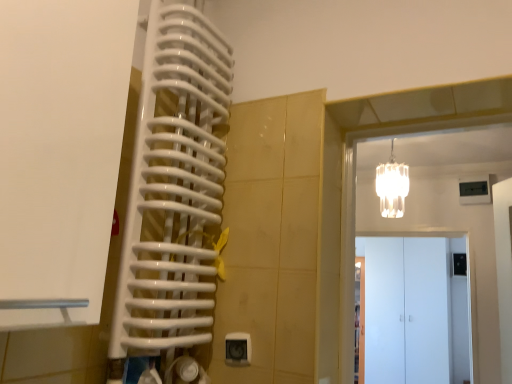
Locate an element on the screen. The image size is (512, 384). white matte cabinet at center, the 2th door viewed from the back is located at coordinates (418, 309).

Measure the distance between point (x=443, y=281) and camera.

Point (x=443, y=281) is 4.21 meters away from camera.

This screenshot has height=384, width=512. What are the coordinates of `white glossy door at right, the third door from the front` in the screenshot? It's located at (360, 319).

The image size is (512, 384). What do you see at coordinates (360, 319) in the screenshot?
I see `white glossy door at right, the 3th door viewed from the top` at bounding box center [360, 319].

Locate an element on the screen. Image resolution: width=512 pixels, height=384 pixels. white matte door at left, placed as the 1th door when sorted from left to right is located at coordinates (60, 153).

From a real-world perspective, who is located lower, white matte door at left, arranged as the 3th door when ordered from the bottom, or white glossy door at right, the first door from the back?

white glossy door at right, the first door from the back.

From the image's perspective, which door is the 2nd one above the white glossy door at right, which is counted as the first door, starting from the bottom? Please provide its 2D coordinates.

[(60, 153)]

How far apart are white matte door at left, placed as the 1th door when sorted from left to right, and white glossy door at right, the first door from the back?

3.26 meters.

Which object is positioned more to the right, white matte door at left, arranged as the 3th door when ordered from the bottom, or white glossy door at right, the third door from the front?

Positioned to the right is white glossy door at right, the third door from the front.

Measure the distance from white matte cabinet at center, acting as the second door starting from the right, to white glass chandelier at upper right.

The distance of white matte cabinet at center, acting as the second door starting from the right, from white glass chandelier at upper right is 6.02 feet.

Does white matte cabinet at center, which ranks as the 2th door in top-to-bottom order, have a greater height compared to white glass chandelier at upper right?

Indeed, white matte cabinet at center, which ranks as the 2th door in top-to-bottom order, has a greater height compared to white glass chandelier at upper right.

From a real-world perspective, which object stands above the other?

From a 3D spatial view, white glass chandelier at upper right is above.

Locate an element on the screen. light fixture above the white matte cabinet at center, the 2th door when ordered from left to right (from the image's perspective) is located at coordinates (392, 186).

From the image's perspective, starting from the white matte door at left, the 3th door viewed from the right, which door is the 1st one below? Please provide its 2D coordinates.

[(418, 309)]

Could you tell me if white matte cabinet at center, acting as the second door starting from the right, is facing white matte door at left, which appears as the third door when viewed from the back?

Yes, white matte cabinet at center, acting as the second door starting from the right, is oriented towards white matte door at left, which appears as the third door when viewed from the back.

Based on their sizes in the image, would you say white matte cabinet at center, the 2th door viewed from the front, is bigger or smaller than white matte door at left, the 3th door viewed from the right?

Clearly, white matte cabinet at center, the 2th door viewed from the front, is smaller in size than white matte door at left, the 3th door viewed from the right.

From the image's perspective, relative to white matte door at left, placed as the 1th door when sorted from left to right, is white matte cabinet at center, the 2th door viewed from the back, above or below?

Based on their image positions, white matte cabinet at center, the 2th door viewed from the back, is located beneath white matte door at left, placed as the 1th door when sorted from left to right.

Which point is more forward, (388,211) or (409,273)?

The point (388,211) is more forward.

From the image's perspective, which object appears higher, white glass chandelier at upper right or white matte cabinet at center, marked as the second door in a bottom-to-top arrangement?

white glass chandelier at upper right, from the image's perspective.

In the scene shown: Choose the correct answer: Is white glass chandelier at upper right inside white matte cabinet at center, marked as the second door in a bottom-to-top arrangement, or outside it?

white glass chandelier at upper right cannot be found inside white matte cabinet at center, marked as the second door in a bottom-to-top arrangement.

From a real-world perspective, is white glass chandelier at upper right physically located above or below white matte cabinet at center, marked as the second door in a bottom-to-top arrangement?

From a real-world perspective, white glass chandelier at upper right is physically above white matte cabinet at center, marked as the second door in a bottom-to-top arrangement.

Is white glass chandelier at upper right oriented towards white matte door at left, placed as the 1th door when sorted from left to right?

Yes, white glass chandelier at upper right is oriented towards white matte door at left, placed as the 1th door when sorted from left to right.

Based on the photo, does white glass chandelier at upper right have a lesser width compared to white matte door at left, marked as the 1th door in a front-to-back arrangement?

Yes, white glass chandelier at upper right is thinner than white matte door at left, marked as the 1th door in a front-to-back arrangement.

From a real-world perspective, between white glass chandelier at upper right and white matte door at left, the 3th door viewed from the right, who is vertically higher?

From a 3D spatial view, white glass chandelier at upper right is above.

Is white glass chandelier at upper right located outside white matte door at left, arranged as the 3th door when ordered from the bottom?

That's correct, white glass chandelier at upper right is outside of white matte door at left, arranged as the 3th door when ordered from the bottom.

Can you tell me how much white glossy door at right, the first door from the back, and white matte door at left, placed as the 1th door when sorted from left to right, differ in facing direction?

white glossy door at right, the first door from the back, and white matte door at left, placed as the 1th door when sorted from left to right, are facing 91.2 degrees away from each other.

Which is more to the left, white glossy door at right, the 3th door viewed from the top, or white matte door at left, placed as the 1th door when sorted from left to right?

white matte door at left, placed as the 1th door when sorted from left to right.

Is white glossy door at right, the third door from the front, next to white matte door at left, placed as the 1th door when sorted from left to right, and touching it?

No, white glossy door at right, the third door from the front, is not touching white matte door at left, placed as the 1th door when sorted from left to right.

Considering the sizes of objects white glossy door at right, the 3th door viewed from the top, and white matte door at left, the 3th door viewed from the right, in the image provided, who is bigger, white glossy door at right, the 3th door viewed from the top, or white matte door at left, the 3th door viewed from the right,?

Bigger between the two is white glossy door at right, the 3th door viewed from the top.

In the scene shown: Is white glossy door at right, which appears as the 1th door when viewed from the right, positioned before white matte cabinet at center, the 2th door viewed from the back?

No, white glossy door at right, which appears as the 1th door when viewed from the right, is behind white matte cabinet at center, the 2th door viewed from the back.

Between white glossy door at right, which is counted as the first door, starting from the bottom, and white matte cabinet at center, which ranks as the 2th door in top-to-bottom order, which one appears on the right side from the viewer's perspective?

white glossy door at right, which is counted as the first door, starting from the bottom.

Is white matte cabinet at center, the 2th door viewed from the back, located within white glossy door at right, which appears as the 1th door when viewed from the right?

No, white glossy door at right, which appears as the 1th door when viewed from the right, does not contain white matte cabinet at center, the 2th door viewed from the back.

Is white glossy door at right, which appears as the 1th door when viewed from the right, thinner than white matte cabinet at center, the 2th door viewed from the back?

No, white glossy door at right, which appears as the 1th door when viewed from the right, is not thinner than white matte cabinet at center, the 2th door viewed from the back.

Which door is the 2nd one when counting from the right side of the white matte door at left, marked as the first door in a top-to-bottom arrangement? Please provide its 2D coordinates.

[(360, 319)]

In order to click on light fixture above the white matte cabinet at center, the 2th door when ordered from left to right (from the image's perspective) in this screenshot , I will do (392, 186).

From the image, which object appears to be farther from white glossy door at right, the third door in the left-to-right sequence, white glass chandelier at upper right or white matte door at left, placed as the 1th door when sorted from left to right?

white matte door at left, placed as the 1th door when sorted from left to right, lies further to white glossy door at right, the third door in the left-to-right sequence, than the other object.

Which object lies further to the anchor point white matte cabinet at center, the 2th door viewed from the front, white matte door at left, which appears as the third door when viewed from the back, or white glossy door at right, which is counted as the first door, starting from the bottom?

Among the two, white matte door at left, which appears as the third door when viewed from the back, is located further to white matte cabinet at center, the 2th door viewed from the front.

Consider the image. From the image, which object appears to be farther from white glossy door at right, the third door from the front, white matte door at left, placed as the 1th door when sorted from left to right, or white glass chandelier at upper right?

white matte door at left, placed as the 1th door when sorted from left to right, lies further to white glossy door at right, the third door from the front, than the other object.

Considering their positions, is white matte cabinet at center, marked as the second door in a bottom-to-top arrangement, positioned closer to white glossy door at right, the 3th door viewed from the top, than white glass chandelier at upper right?

The object closer to white glossy door at right, the 3th door viewed from the top, is white matte cabinet at center, marked as the second door in a bottom-to-top arrangement.

Looking at the image, which one is located further to white matte door at left, marked as the 1th door in a front-to-back arrangement, white glossy door at right, the 3th door viewed from the top, or white glass chandelier at upper right?

Based on the image, white glossy door at right, the 3th door viewed from the top, appears to be further to white matte door at left, marked as the 1th door in a front-to-back arrangement.

Looking at the image, which one is located closer to white glass chandelier at upper right, white matte door at left, the 3th door viewed from the right, or white matte cabinet at center, the 2th door viewed from the front?

white matte cabinet at center, the 2th door viewed from the front, is positioned closer to the anchor white glass chandelier at upper right.

Looking at the image, which one is located closer to white matte door at left, which appears as the third door when viewed from the back, white glass chandelier at upper right or white glossy door at right, the first door from the back?

Among the two, white glass chandelier at upper right is located nearer to white matte door at left, which appears as the third door when viewed from the back.

Which object lies further to the anchor point white glass chandelier at upper right, white matte door at left, which appears as the third door when viewed from the back, or white glossy door at right, the 3th door viewed from the top?

The object further to white glass chandelier at upper right is white matte door at left, which appears as the third door when viewed from the back.

Where is `door between white matte door at left, arranged as the 3th door when ordered from the bottom, and white glossy door at right, the third door in the left-to-right sequence, in the front-back direction`? This screenshot has height=384, width=512. door between white matte door at left, arranged as the 3th door when ordered from the bottom, and white glossy door at right, the third door in the left-to-right sequence, in the front-back direction is located at coordinates (418, 309).

Find the location of a particular element. door located between white glass chandelier at upper right and white glossy door at right, the third door in the left-to-right sequence, in the depth direction is located at coordinates (418, 309).

Locate an element on the screen. Image resolution: width=512 pixels, height=384 pixels. light fixture between white matte door at left, the 3th door viewed from the right, and white matte cabinet at center, acting as the second door starting from the right, from front to back is located at coordinates (392, 186).

Image resolution: width=512 pixels, height=384 pixels. In order to click on light fixture between white matte door at left, arranged as the 3th door when ordered from the bottom, and white glossy door at right, the 3th door viewed from the top, in the front-back direction in this screenshot , I will do `click(392, 186)`.